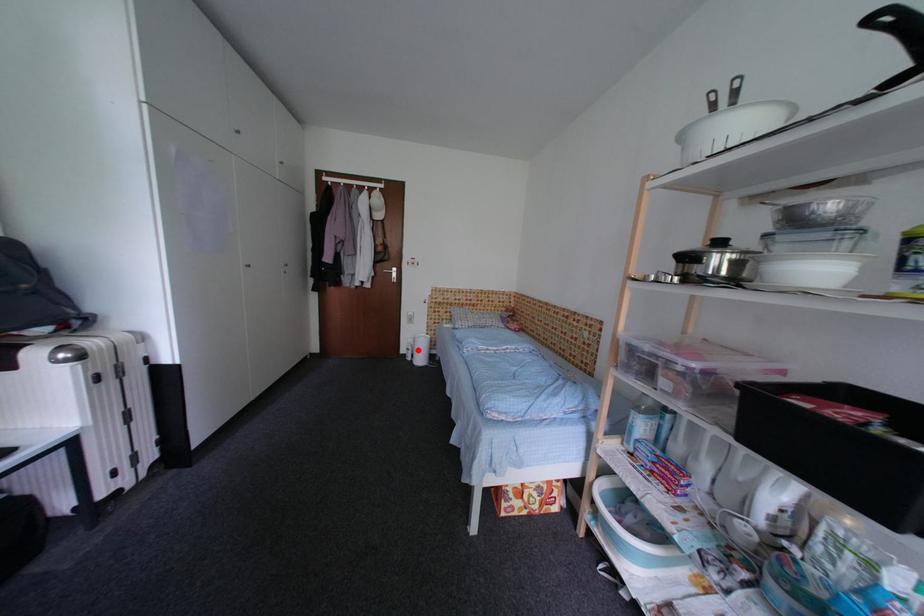
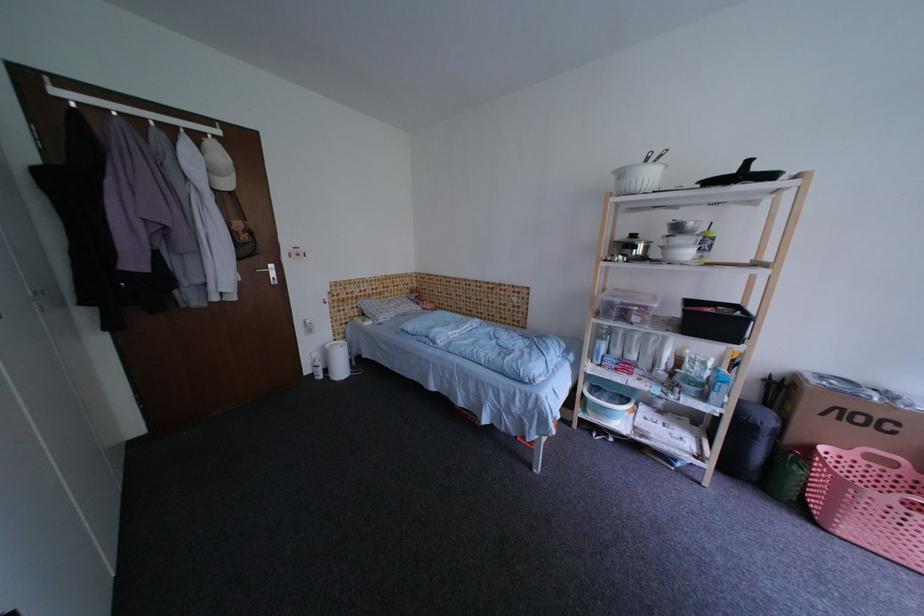
In the second image, find the point that corresponds to the highlighted location in the first image.

(326, 366)